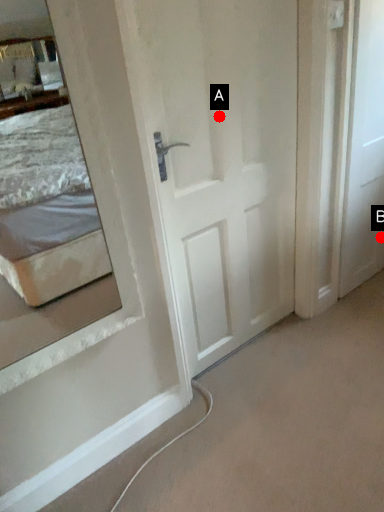
Question: Two points are circled on the image, labeled by A and B beside each circle. Among these points, which one is nearest to the camera?

Choices:
 (A) A is closer
 (B) B is closer

Answer: (A)